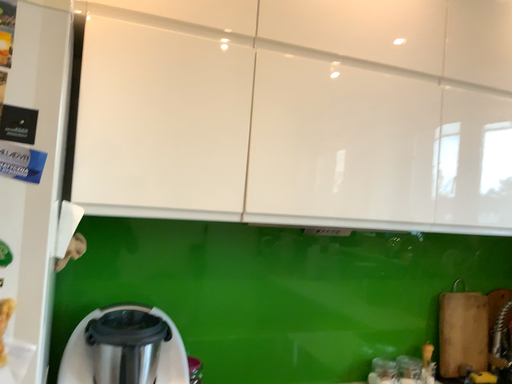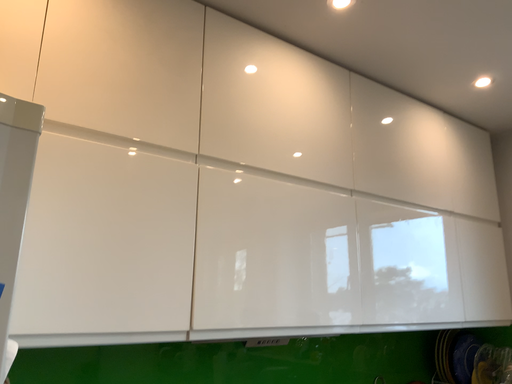
Question: How did the camera likely rotate when shooting the video?

Choices:
 (A) rotated right
 (B) rotated left

Answer: (A)